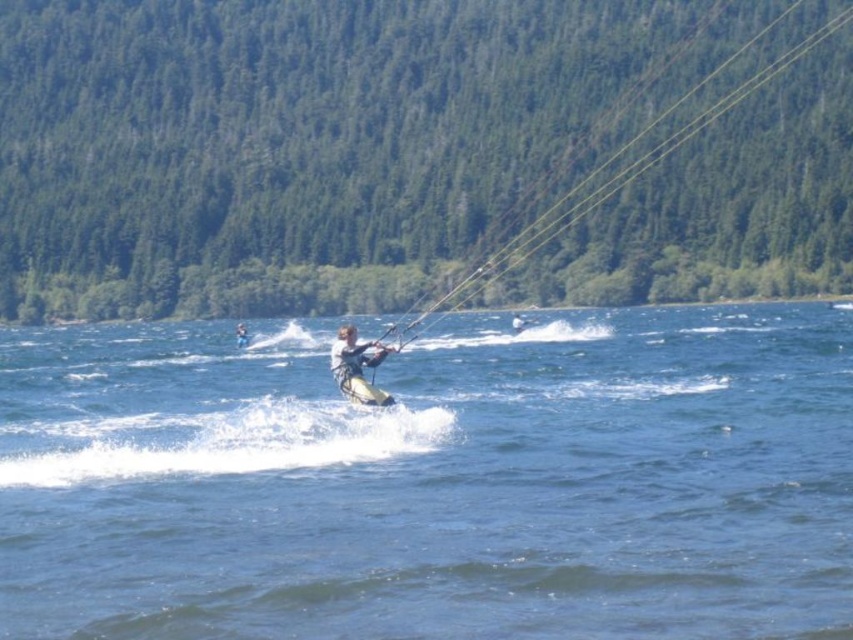
Does green textured forest at upper center have a lesser width compared to white matte kite surfer at center?

In fact, green textured forest at upper center might be wider than white matte kite surfer at center.

Which is in front, point (770, 253) or point (355, 353)?

Point (355, 353) is more forward.

Between point (456, 100) and point (346, 326), which one is positioned behind?

The point (456, 100) is more distant.

I want to click on green textured forest at upper center, so pyautogui.click(x=416, y=152).

Looking at this image, is the position of green textured forest at upper center more distant than that of yellow-green wetsuit at center?

Yes.

Is green textured forest at upper center above yellow-green wetsuit at center?

Yes, green textured forest at upper center is above yellow-green wetsuit at center.

Which is behind, point (294, 198) or point (244, 333)?

The point (294, 198) is more distant.

You are a GUI agent. You are given a task and a screenshot of the screen. Output one action in this format:
    pyautogui.click(x=<x>, y=<y>)
    Task: Click on the green textured forest at upper center
    
    Given the screenshot: What is the action you would take?
    pyautogui.click(x=416, y=152)

Which is behind, point (136, 502) or point (343, 344)?

Point (343, 344)

Can you confirm if blue water at center is bigger than white matte kite surfer at center?

Correct, blue water at center is larger in size than white matte kite surfer at center.

The width and height of the screenshot is (853, 640). Find the location of `blue water at center`. blue water at center is located at coordinates 432,480.

At what (x,y) coordinates should I click in order to perform the action: click on blue water at center. Please return your answer as a coordinate pair (x, y). Looking at the image, I should click on (432, 480).